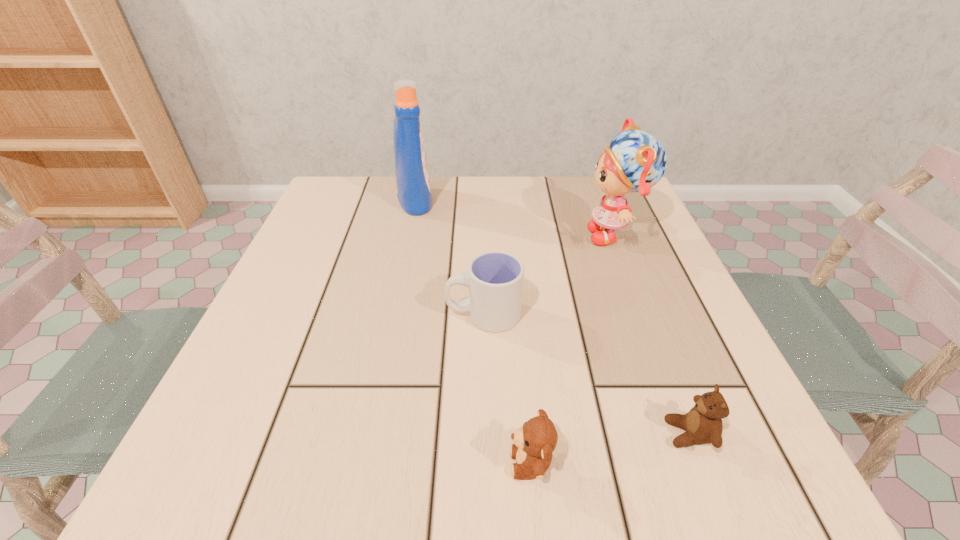
Locate an element on the screen. This screenshot has width=960, height=540. doll that is at the far edge is located at coordinates (635, 161).

I want to click on doll that is at the right edge, so click(x=635, y=161).

I want to click on teddy bear that is at the right edge, so click(703, 424).

Where is `object located in the far right corner section of the desktop`? This screenshot has width=960, height=540. object located in the far right corner section of the desktop is located at coordinates pos(635,161).

This screenshot has width=960, height=540. In order to click on object positioned at the near right corner in this screenshot , I will do `click(703, 424)`.

In the image, there is a desktop. What are the coordinates of `vacant space at the far edge` in the screenshot? It's located at (400, 206).

You are a GUI agent. You are given a task and a screenshot of the screen. Output one action in this format:
    pyautogui.click(x=<x>, y=<y>)
    Task: Click on the vacant region at the near edge
    Image resolution: width=960 pixels, height=540 pixels.
    Given the screenshot: What is the action you would take?
    pyautogui.click(x=613, y=485)

Where is `vacant space at the left edge`? Image resolution: width=960 pixels, height=540 pixels. vacant space at the left edge is located at coordinates (236, 386).

Locate an element on the screen. The image size is (960, 540). free space at the right edge is located at coordinates (660, 238).

At what (x,y) coordinates should I click in order to perform the action: click on vacant space at the far left corner of the desktop. Please return your answer as a coordinate pair (x, y). The width and height of the screenshot is (960, 540). Looking at the image, I should click on (351, 180).